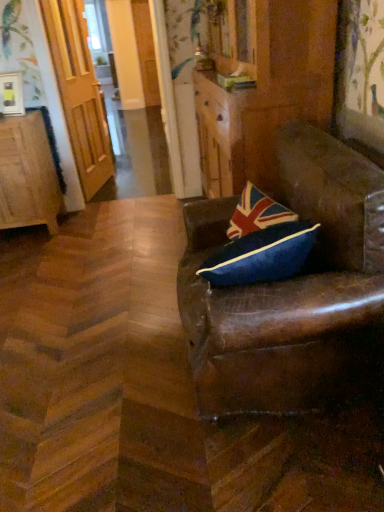
Question: Considering the relative positions of brown leather chair at right and wooden door at left in the image provided, is brown leather chair at right in front of wooden door at left?

Choices:
 (A) no
 (B) yes

Answer: (B)

Question: From a real-world perspective, is brown leather chair at right positioned over wooden door at left based on gravity?

Choices:
 (A) yes
 (B) no

Answer: (B)

Question: Considering the relative positions of brown leather chair at right and wooden door at left in the image provided, is brown leather chair at right behind wooden door at left?

Choices:
 (A) yes
 (B) no

Answer: (B)

Question: From the image's perspective, does brown leather chair at right appear higher than wooden door at left?

Choices:
 (A) no
 (B) yes

Answer: (A)

Question: Considering the relative sizes of brown leather chair at right and wooden door at left in the image provided, is brown leather chair at right taller than wooden door at left?

Choices:
 (A) no
 (B) yes

Answer: (A)

Question: Is brown leather chair at right spatially inside wooden door at left, or outside of it?

Choices:
 (A) inside
 (B) outside

Answer: (B)

Question: From their relative heights in the image, would you say brown leather chair at right is taller or shorter than wooden door at left?

Choices:
 (A) short
 (B) tall

Answer: (A)

Question: In the image, is brown leather chair at right on the left side or the right side of wooden door at left?

Choices:
 (A) left
 (B) right

Answer: (B)

Question: Looking at their shapes, would you say brown leather chair at right is wider or thinner than wooden door at left?

Choices:
 (A) wide
 (B) thin

Answer: (A)

Question: Considering the positions of brown leather dresser at center and brown leather chair at right in the image, is brown leather dresser at center taller or shorter than brown leather chair at right?

Choices:
 (A) tall
 (B) short

Answer: (A)

Question: In the image, is brown leather dresser at center on the left side or the right side of brown leather chair at right?

Choices:
 (A) left
 (B) right

Answer: (A)

Question: In terms of width, does brown leather dresser at center look wider or thinner when compared to brown leather chair at right?

Choices:
 (A) thin
 (B) wide

Answer: (A)

Question: Considering the positions of point (230, 159) and point (344, 282), is point (230, 159) closer or farther from the camera than point (344, 282)?

Choices:
 (A) closer
 (B) farther

Answer: (B)

Question: From their relative heights in the image, would you say wooden cabinet at left is taller or shorter than brown leather chair at right?

Choices:
 (A) short
 (B) tall

Answer: (A)

Question: Considering the positions of wooden cabinet at left and brown leather chair at right in the image, is wooden cabinet at left wider or thinner than brown leather chair at right?

Choices:
 (A) wide
 (B) thin

Answer: (B)